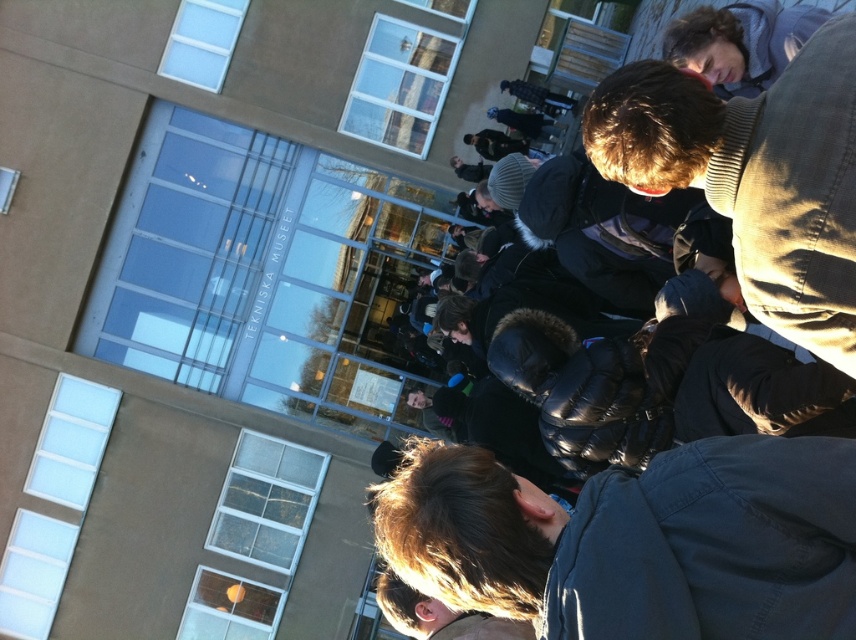
You are a photographer trying to capture a group photo of the dark brown hair at upper right and the blonde hair at lower center. If you want to ensure both subjects are in focus, which person should you adjust the camera focus on first considering their size in the frame?

The dark brown hair at upper right has a smaller width than the blonde hair at lower center, so you should focus on the blonde hair at lower center first since it takes up more space in the frame.

You are standing at the entrance of the museum and want to move towards the point labeled as point (385, 616). However, there is an obstacle at point (700, 20). Will you be able to reach your destination without going around the obstacle?

Point (700, 20) is in front of point (385, 616), so you will encounter the obstacle first and cannot reach the destination without going around it.

You are a photographer standing in front of the museum. You notice a person wearing a dark blue jacket at center and another person with dark brown hair at lower center. Which of these two people is positioned higher in the image?

The dark blue jacket at center is positioned higher in the image than the dark brown hair at lower center.